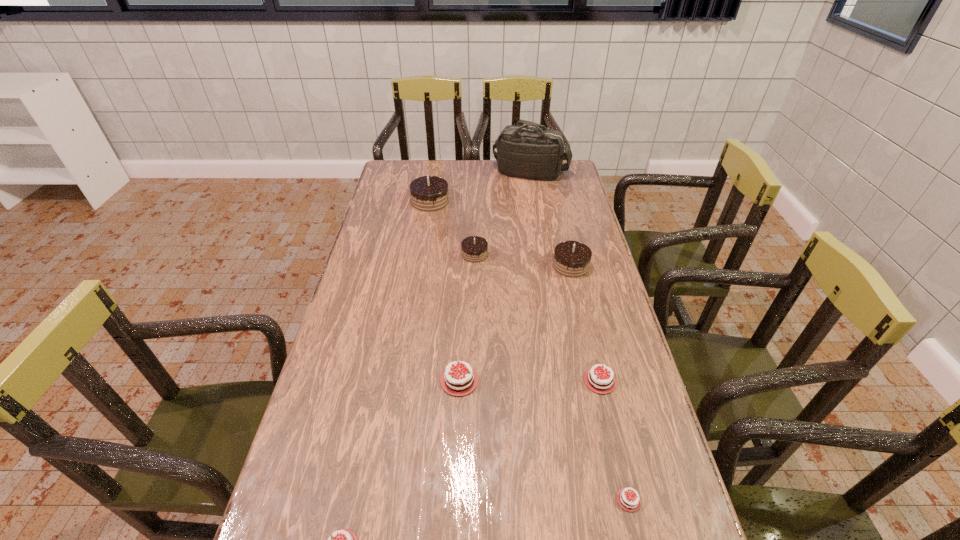
Find the location of `free space located 0.270m on the left of the shortest object`. free space located 0.270m on the left of the shortest object is located at coordinates (473, 500).

Find the location of a particular element. The width and height of the screenshot is (960, 540). object located in the far edge section of the desktop is located at coordinates (536, 152).

This screenshot has height=540, width=960. What are the coordinates of `object that is positioned at the left edge` in the screenshot? It's located at (428, 193).

You are a GUI agent. You are given a task and a screenshot of the screen. Output one action in this format:
    pyautogui.click(x=<x>, y=<y>)
    Task: Click on the shoulder bag present at the right edge
    The height and width of the screenshot is (540, 960).
    Given the screenshot: What is the action you would take?
    pyautogui.click(x=536, y=152)

Where is `object that is at the far right corner`? object that is at the far right corner is located at coordinates (536, 152).

Locate an element on the screen. vacant area at the far edge of the desktop is located at coordinates (450, 186).

In the image, there is a desktop. Where is `free space at the left edge`? The image size is (960, 540). free space at the left edge is located at coordinates (368, 231).

In the image, there is a desktop. What are the coordinates of `vacant space at the right edge` in the screenshot? It's located at (564, 194).

Find the location of a particular element. The height and width of the screenshot is (540, 960). vacant space at the far left corner is located at coordinates coord(386,174).

In order to click on empty space between the second tallest object and the smallest red chocolate cake in this screenshot , I will do `click(529, 350)`.